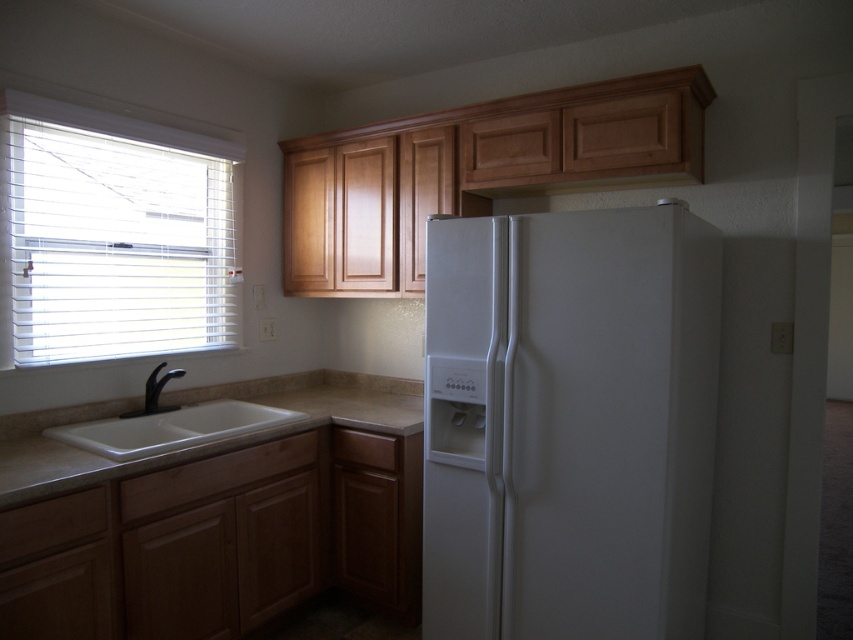
Question: Which object is farther from the camera taking this photo?

Choices:
 (A) white matte refrigerator at center
 (B) white blinds at left
 (C) beige granite countertop at lower left
 (D) black matte faucet at sink left

Answer: (D)

Question: Estimate the real-world distances between objects in this image. Which object is farther from the white blinds at left?

Choices:
 (A) black matte faucet at sink left
 (B) beige granite countertop at lower left

Answer: (B)

Question: Estimate the real-world distances between objects in this image. Which object is closer to the white matte refrigerator at center?

Choices:
 (A) black matte faucet at sink left
 (B) white blinds at left
 (C) beige granite countertop at lower left
 (D) white ceramic sink at lower left

Answer: (C)

Question: Does white matte refrigerator at center appear on the left side of white blinds at left?

Choices:
 (A) yes
 (B) no

Answer: (B)

Question: Does white blinds at left appear on the left side of black matte faucet at sink left?

Choices:
 (A) yes
 (B) no

Answer: (A)

Question: Can you confirm if white blinds at left is positioned above black matte faucet at sink left?

Choices:
 (A) no
 (B) yes

Answer: (B)